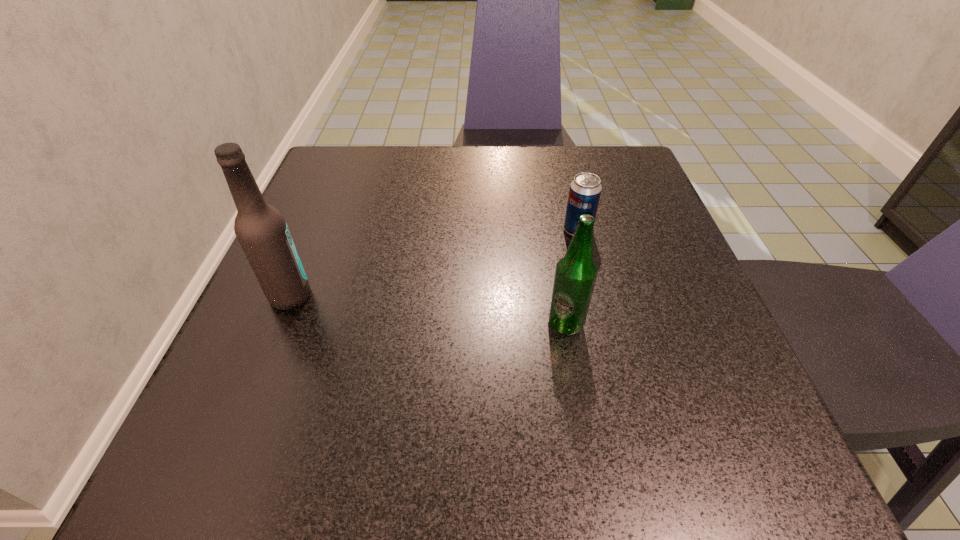
Locate an element on the screen. This screenshot has width=960, height=540. vacant area between the second tallest object and the tallest object is located at coordinates (428, 310).

Identify the location of free space between the taller beer bottle and the shortest object. (434, 263).

The width and height of the screenshot is (960, 540). What are the coordinates of `free space between the farthest object and the leftmost object` in the screenshot? It's located at (434, 263).

Locate an element on the screen. The width and height of the screenshot is (960, 540). vacant space that is in between the tallest object and the beer can is located at coordinates (434, 263).

Image resolution: width=960 pixels, height=540 pixels. I want to click on blank region between the shortest object and the left beer bottle, so click(x=434, y=263).

Where is `free space between the taller beer bottle and the right beer bottle`? free space between the taller beer bottle and the right beer bottle is located at coordinates (428, 310).

Locate which object is the second closest to the second shortest object. Please provide its 2D coordinates. Your answer should be formatted as a tuple, i.e. [(x, y)], where the tuple contains the x and y coordinates of a point satisfying the conditions above.

[(261, 230)]

Locate which object is the second closest to the second shortest object. Please provide its 2D coordinates. Your answer should be formatted as a tuple, i.e. [(x, y)], where the tuple contains the x and y coordinates of a point satisfying the conditions above.

[(261, 230)]

What are the coordinates of `free space that satisfies the following two spatial constraints: 1. on the front side of the shortest object; 2. on the label of the left beer bottle` in the screenshot? It's located at (594, 296).